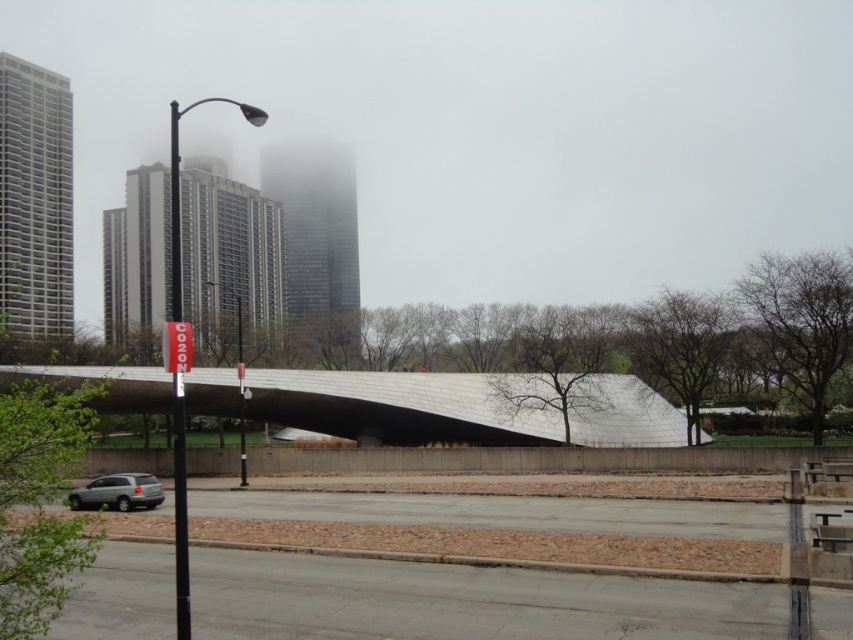
Is silver metallic overpass at center shorter than silver metallic suv at lower left?

In fact, silver metallic overpass at center may be taller than silver metallic suv at lower left.

Measure the distance between silver metallic overpass at center and camera.

A distance of 37.48 meters exists between silver metallic overpass at center and camera.

Describe the element at coordinates (401, 406) in the screenshot. I see `silver metallic overpass at center` at that location.

Where is `silver metallic overpass at center`? silver metallic overpass at center is located at coordinates (401, 406).